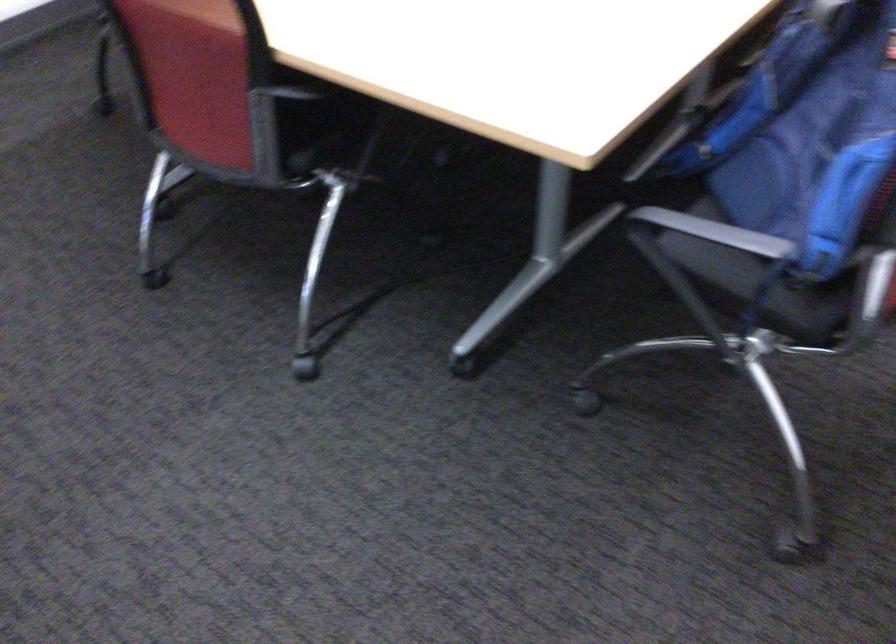
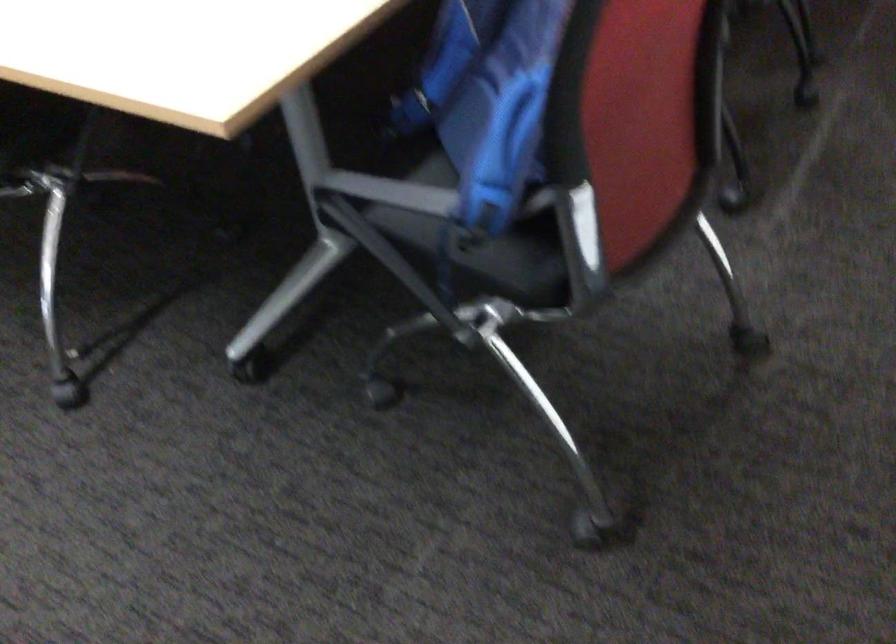
The point at (742, 251) is marked in the first image. Where is the corresponding point in the second image?

(416, 207)